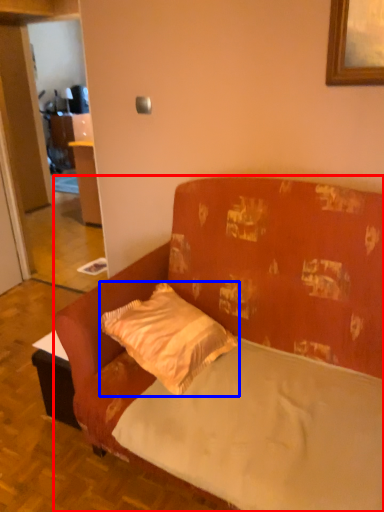
Question: Which object is further to the camera taking this photo, studio couch (highlighted by a red box) or pillow (highlighted by a blue box)?

Choices:
 (A) studio couch
 (B) pillow

Answer: (B)